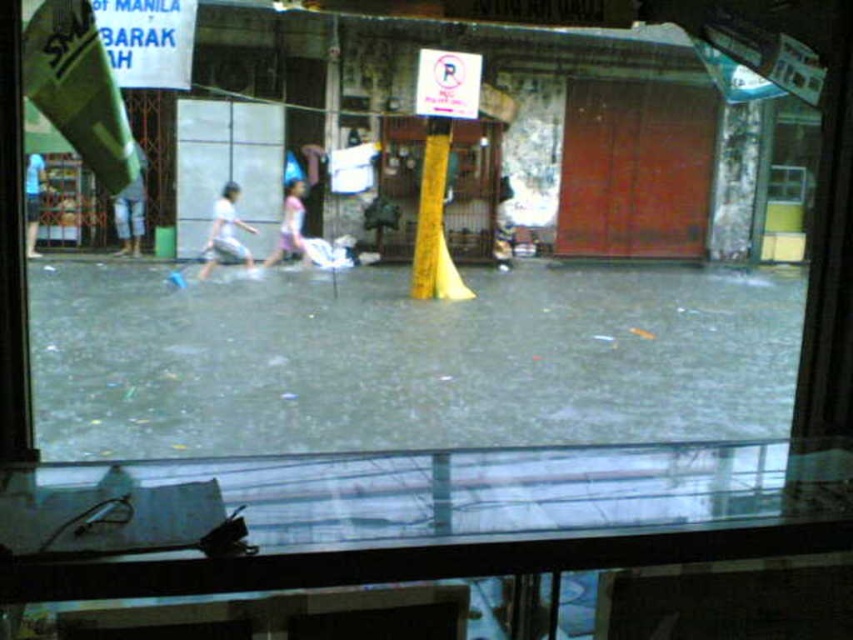
Is light blue jeans at left below light blue t-shirt at left?

Incorrect, light blue jeans at left is not positioned below light blue t-shirt at left.

Which is behind, point (125, 240) or point (44, 180)?

Positioned behind is point (125, 240).

Is point (125, 243) more distant than point (38, 253)?

That is True.

Identify the location of light blue jeans at left. The width and height of the screenshot is (853, 640). (131, 209).

Which is in front, point (434, 212) or point (125, 225)?

Point (434, 212)

Between point (440, 275) and point (135, 225), which one is positioned behind?

Positioned behind is point (135, 225).

Is point (448, 147) behind point (143, 156)?

No, (448, 147) is in front of (143, 156).

This screenshot has height=640, width=853. I want to click on yellow wood pole at center, so click(x=431, y=214).

Which is more to the left, white paper sign at upper center or white cotton pants at left?

white cotton pants at left is more to the left.

At what (x,y) coordinates should I click in order to perform the action: click on white paper sign at upper center. Please return your answer as a coordinate pair (x, y). Image resolution: width=853 pixels, height=640 pixels. Looking at the image, I should click on (447, 83).

This screenshot has height=640, width=853. Identify the location of white paper sign at upper center. (447, 83).